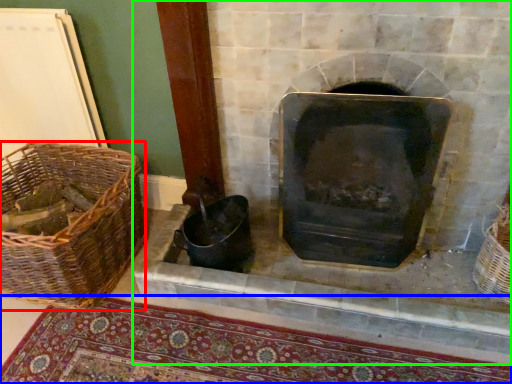
Question: Which object is the closest to the basket (highlighted by a red box)? Choose among these: mat (highlighted by a blue box) or fireplace (highlighted by a green box).

Choices:
 (A) mat
 (B) fireplace

Answer: (A)